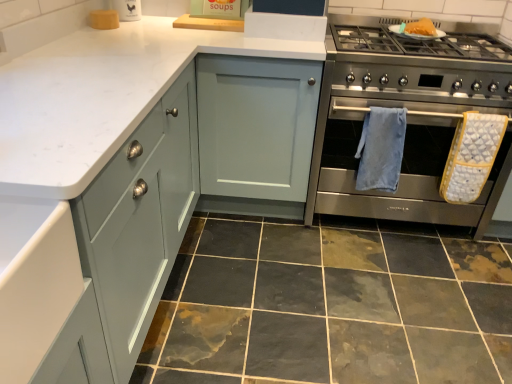
Question: From a real-world perspective, is white marble countertop at upper left positioned above or below marble tile at lower center?

Choices:
 (A) below
 (B) above

Answer: (B)

Question: Would you say white marble countertop at upper left is to the left or to the right of marble tile at lower center in the picture?

Choices:
 (A) right
 (B) left

Answer: (B)

Question: Estimate the real-world distances between objects in this image. Which object is closer to the yellow textured oven mitt at right, positioned as the first bath towel in right-to-left order?

Choices:
 (A) white marble countertop at upper left
 (B) marble tile at lower center
 (C) blue soft towel at center right, the 2th bath towel positioned from the right
 (D) stainless steel oven at right

Answer: (D)

Question: Which object is positioned closest to the white marble countertop at upper left?

Choices:
 (A) blue soft towel at center right, the 2th bath towel positioned from the right
 (B) marble tile at lower center
 (C) yellow textured oven mitt at right, positioned as the first bath towel in right-to-left order
 (D) stainless steel oven at right

Answer: (A)